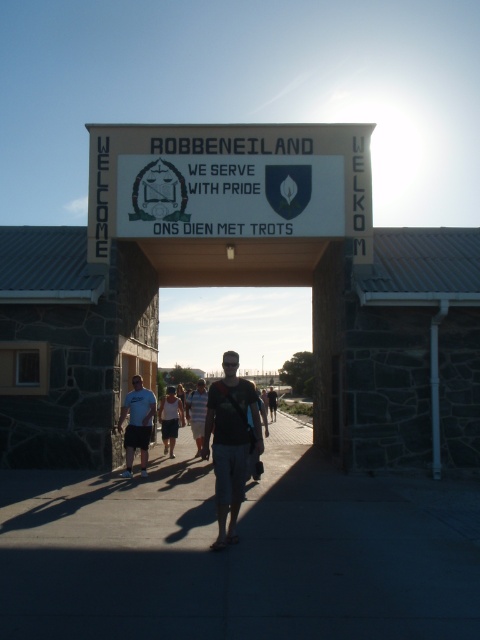
Is point (206, 406) positioned before point (203, 442)?

Yes, it is.

Measure the distance between dark fabric backpack at center and dark blue t-shirt at center.

dark fabric backpack at center is 25.19 feet from dark blue t-shirt at center.

Is point (240, 433) more distant than point (203, 400)?

No, it is not.

You are a GUI agent. You are given a task and a screenshot of the screen. Output one action in this format:
    pyautogui.click(x=<x>, y=<y>)
    Task: Click on the dark fabric backpack at center
    The image size is (480, 640).
    Given the screenshot: What is the action you would take?
    pyautogui.click(x=230, y=442)

Is dark fabric backpack at center further to camera compared to light blue denim shorts at center?

No.

You are a GUI agent. You are given a task and a screenshot of the screen. Output one action in this format:
    pyautogui.click(x=<x>, y=<y>)
    Task: Click on the dark fabric backpack at center
    This screenshot has height=640, width=480.
    Given the screenshot: What is the action you would take?
    pyautogui.click(x=230, y=442)

Between dark fabric backpack at center and dark brown leather backpack at center, which one is positioned higher?

dark fabric backpack at center is above.

Find the location of `dark fabric backpack at center`. dark fabric backpack at center is located at coordinates (x=230, y=442).

What are the coordinates of `dark fabric backpack at center` in the screenshot? It's located at (230, 442).